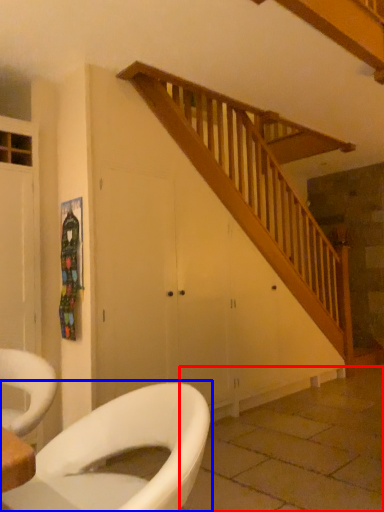
Question: Which of the following is the closest to the observer, tile (highlighted by a red box) or toilet (highlighted by a blue box)?

Choices:
 (A) tile
 (B) toilet

Answer: (B)